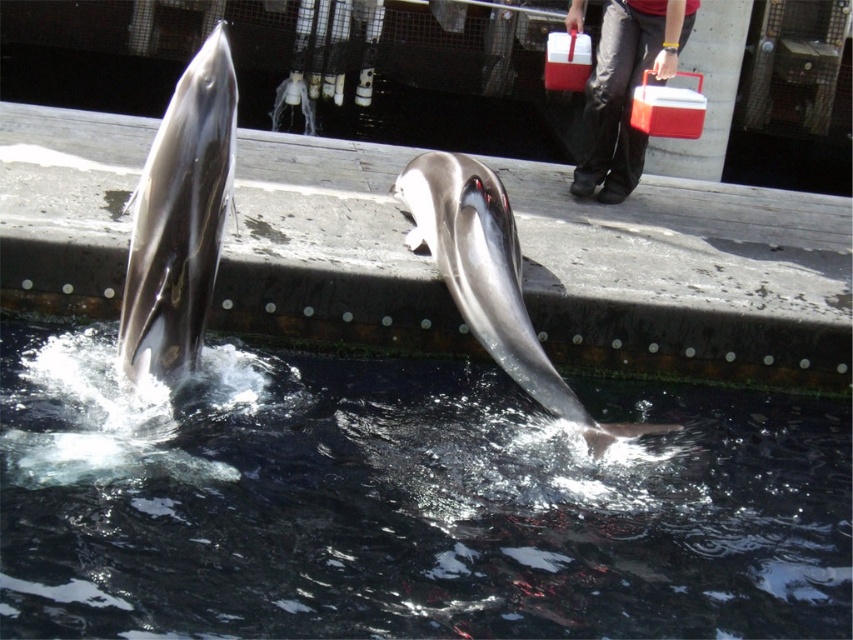
Question: Which point appears farthest from the camera in this image?

Choices:
 (A) (595, 92)
 (B) (498, 182)

Answer: (A)

Question: Which of these objects is positioned farthest from the clear water at center?

Choices:
 (A) shiny silver dolphin at center
 (B) shiny gray dolphin at upper left

Answer: (B)

Question: Which point is closer to the camera?

Choices:
 (A) shiny silver dolphin at center
 (B) shiny gray dolphin at upper left
 (C) clear water at center
 (D) red plastic cooler at upper right

Answer: (C)

Question: Is the position of clear water at center less distant than that of shiny silver dolphin at center?

Choices:
 (A) no
 (B) yes

Answer: (B)

Question: Can you confirm if clear water at center is thinner than shiny silver dolphin at center?

Choices:
 (A) yes
 (B) no

Answer: (B)

Question: Can you confirm if clear water at center is positioned above red plastic cooler at upper right?

Choices:
 (A) no
 (B) yes

Answer: (A)